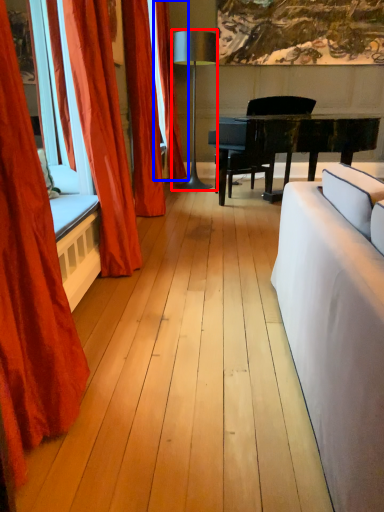
Question: Which point is closer to the camera, lamp (highlighted by a red box) or curtain (highlighted by a blue box)?

Choices:
 (A) lamp
 (B) curtain

Answer: (A)